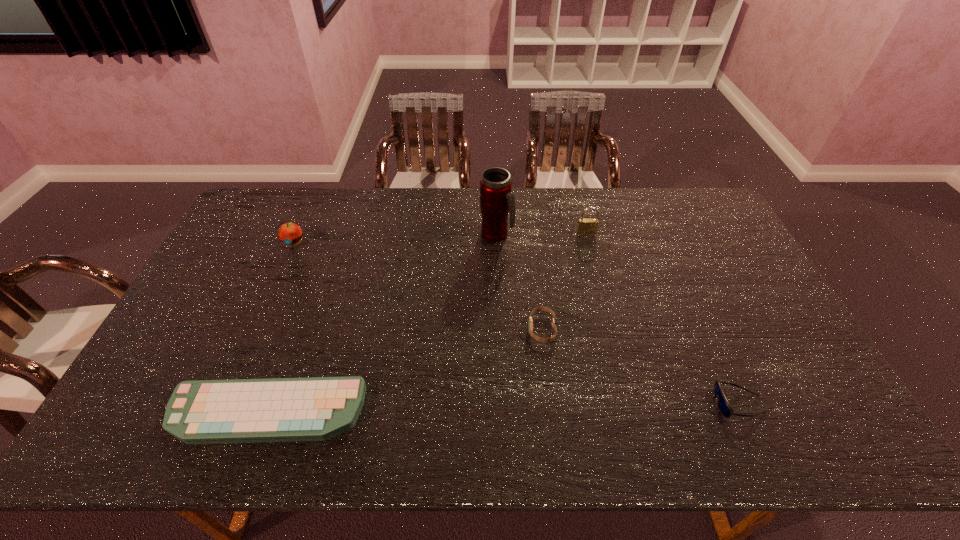
Identify the location of the tallest object. (497, 202).

Image resolution: width=960 pixels, height=540 pixels. I want to click on the third object from left to right, so click(x=497, y=202).

The height and width of the screenshot is (540, 960). Identify the location of padlock. (586, 226).

Where is `the fifth shortest object`? The width and height of the screenshot is (960, 540). the fifth shortest object is located at coordinates (586, 226).

The width and height of the screenshot is (960, 540). In order to click on the third tallest object in this screenshot , I will do `click(290, 234)`.

This screenshot has width=960, height=540. In order to click on watch in this screenshot , I will do `click(530, 324)`.

At what (x,y) coordinates should I click in order to perform the action: click on the fourth object from left to right. Please return your answer as a coordinate pair (x, y). The width and height of the screenshot is (960, 540). Looking at the image, I should click on (530, 324).

Find the location of a particular element. Image resolution: width=960 pixels, height=540 pixels. the rightmost object is located at coordinates (724, 406).

The height and width of the screenshot is (540, 960). I want to click on the shortest object, so click(x=318, y=408).

You are a GUI agent. You are given a task and a screenshot of the screen. Output one action in this format:
    pyautogui.click(x=<x>, y=<y>)
    Task: Click on the free spot located 0.140m on the side with the handle of the thermos bottle
    Image resolution: width=960 pixels, height=540 pixels.
    Given the screenshot: What is the action you would take?
    pyautogui.click(x=554, y=235)